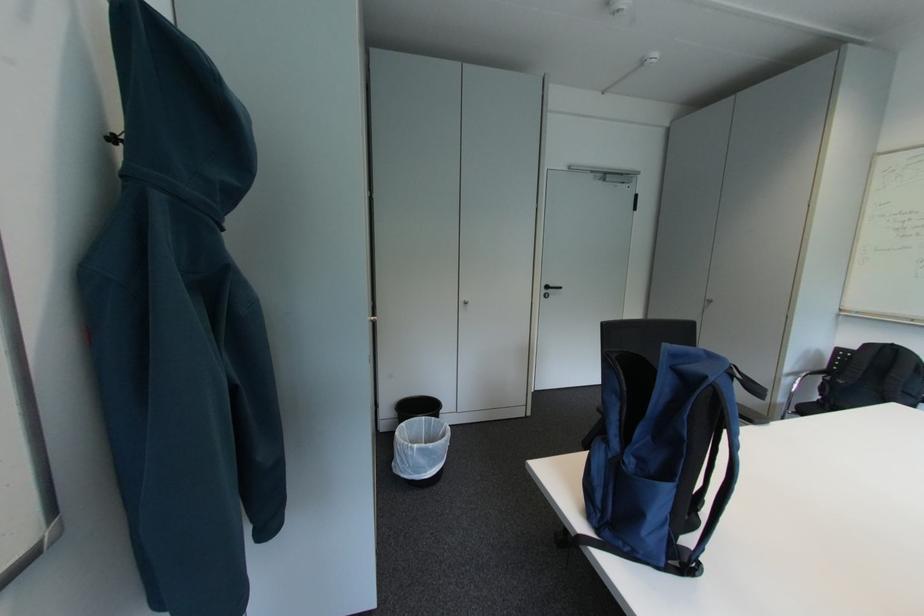
I want to click on backpack top handle, so click(748, 397).